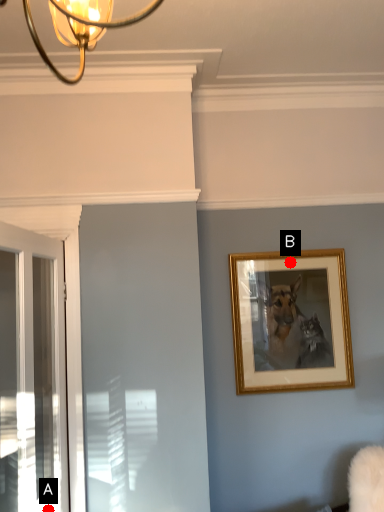
Question: Two points are circled on the image, labeled by A and B beside each circle. Which point is farther to the camera?

Choices:
 (A) A is further
 (B) B is further

Answer: (B)